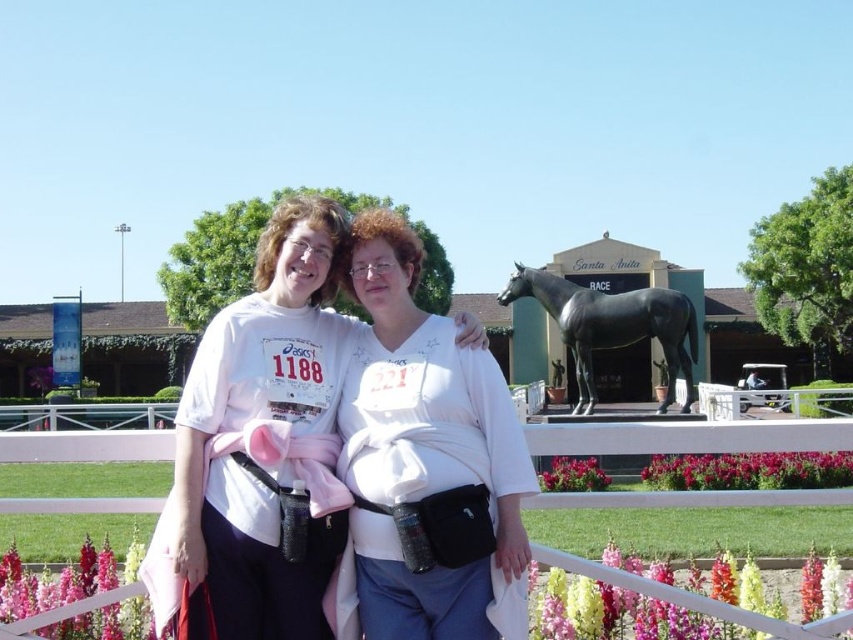
Question: Is white plastic fence at center positioned before black polished horse at center?

Choices:
 (A) no
 (B) yes

Answer: (B)

Question: Which object is closer to the camera taking this photo?

Choices:
 (A) black polished horse at center
 (B) white plastic fence at center

Answer: (B)

Question: Which of the following is the closest to the observer?

Choices:
 (A) (339, 529)
 (B) (659, 289)

Answer: (A)

Question: Among these objects, which one is farthest from the camera?

Choices:
 (A) black polished horse at center
 (B) white matte shirt at center

Answer: (A)

Question: Does white matte shirt at center appear over black polished horse at center?

Choices:
 (A) yes
 (B) no

Answer: (A)

Question: Can you confirm if white matte shirt at center is positioned to the left of white plastic fence at center?

Choices:
 (A) no
 (B) yes

Answer: (B)